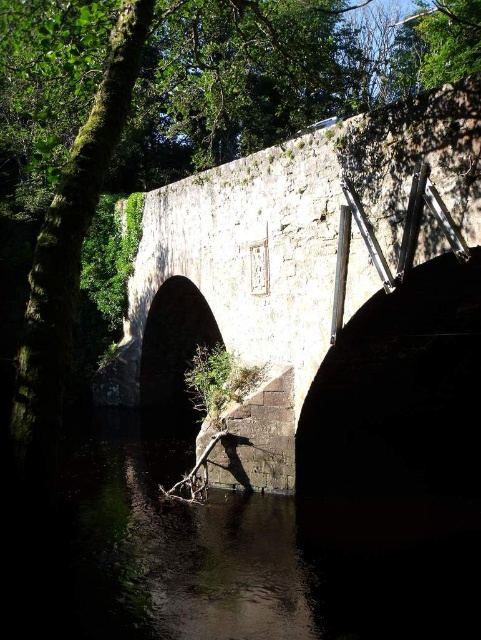
Is dark stone water at lower center below stone bridge at center?

Indeed, dark stone water at lower center is positioned under stone bridge at center.

Does point (121, 611) come behind point (228, 337)?

No, it is in front of (228, 337).

I want to click on dark stone water at lower center, so click(220, 554).